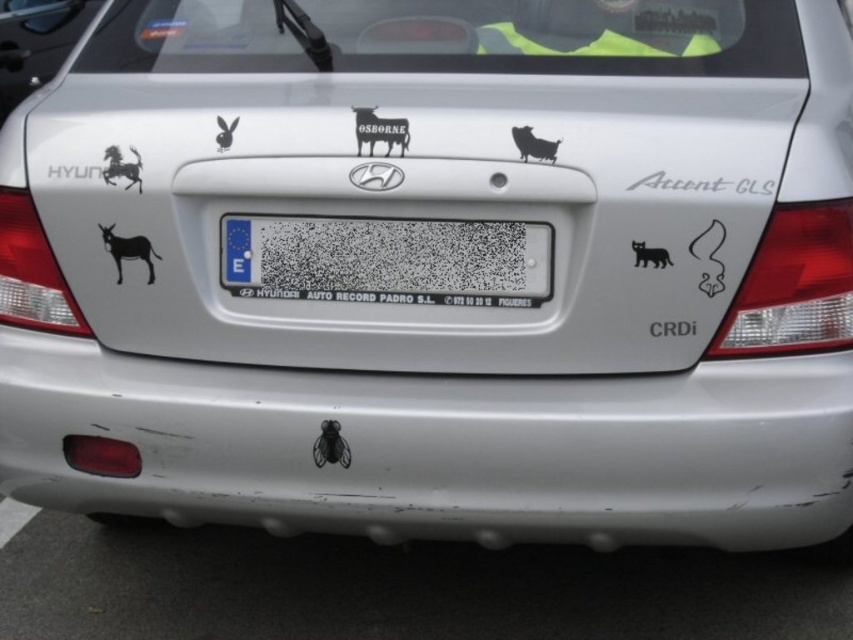
You are a delivery person who needs to place a small package on the Hyundai Accent GLS CRDi car. The package must be placed on the trunk area. According to the image, where should you place the package so that it is below the black matte cat at right but above the black matte sticker at lower center?

The black matte sticker at lower center is located below the black matte cat at right. Therefore, to place the package below the black matte cat at right but above the black matte sticker at lower center, position it between these two objects on the trunk.

You are a delivery driver who needs to place a package on the trunk of the Hyundai Accent GLS CRDi car. The package is 10 cm wide and must be placed at the exact center of the trunk. However, there is a black matte cat at right sticker already occupying part of the trunk. Can you fit the package without overlapping the sticker? Please provide coordinates in the format x between 0 and 1, y between 0 and 1. The trunk is represented as a rectangle from x 0 to 1 and y 0 to 1.

The black matte cat at right is located at point (648, 256). The center of the trunk is at point (426, 320). The distance between them is sqrt of 0.1 squared plus 0.262 squared which is approximately 0.285. Since the package is 10 cm wide, assuming the trunk is 1 meter wide, the required space is 0.1 meters. The distance between the center and the sticker is 28.5 cm, which is more than 10 cm. Therefore, the package can be placed at the center without overlapping the sticker.